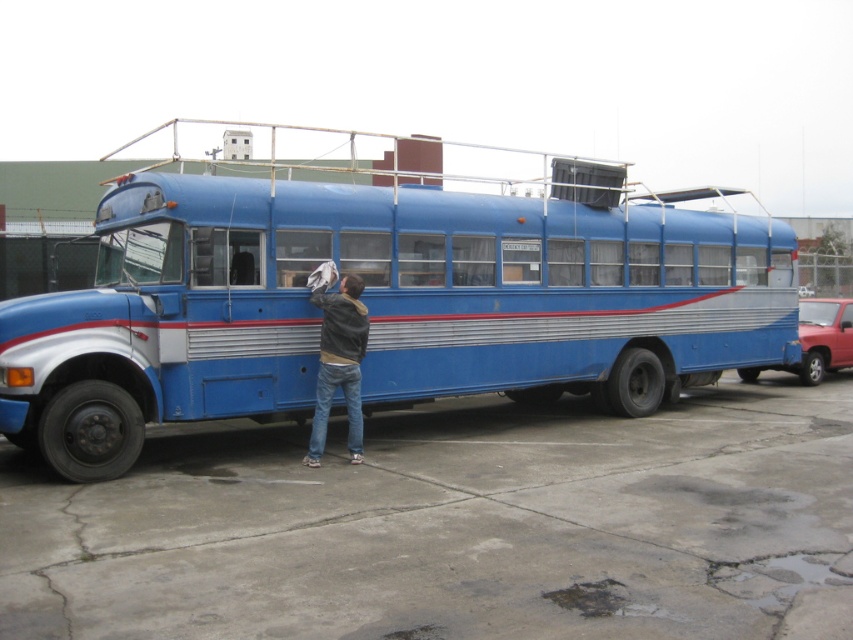
You are standing on the concrete at lower center and want to reach the jeans at lower center. Can you step onto the jeans without stepping off the concrete?

The concrete at lower center is below the jeans at lower center, so stepping onto the jeans would require stepping off the concrete.

You are standing in front of the vintage bus and notice the concrete at lower center and the jeans at lower center. Which object is nearer to you?

The concrete at lower center is closer to the viewer than the jeans at lower center.

You are standing in front of the vintage bus and notice the concrete at lower center and the jeans at lower center. Which one is wider?

The concrete at lower center is wider than the jeans at lower center.